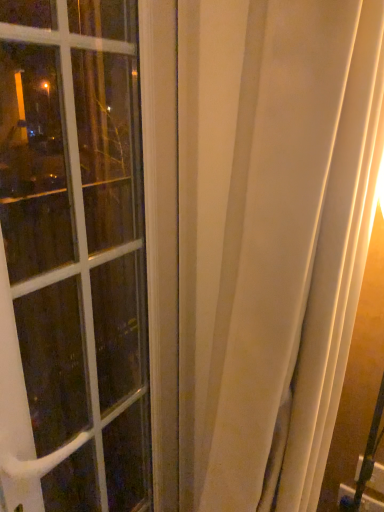
Locate an element on the screen. The height and width of the screenshot is (512, 384). white glass window at left is located at coordinates (76, 261).

The height and width of the screenshot is (512, 384). Describe the element at coordinates (76, 261) in the screenshot. I see `white glass window at left` at that location.

What is the approximate width of white glass window at left?

1.50 inches.

In order to face white sheer curtain at center, should I rotate leftwards or rightwards?

Turn right approximately 7.435 degrees to face it.

What do you see at coordinates (271, 238) in the screenshot? I see `white sheer curtain at center` at bounding box center [271, 238].

Where is `white sheer curtain at center`? This screenshot has width=384, height=512. white sheer curtain at center is located at coordinates (271, 238).

I want to click on white glass window at left, so click(x=76, y=261).

Considering the relative positions of white glass window at left and white sheer curtain at center in the image provided, is white glass window at left to the left of white sheer curtain at center from the viewer's perspective?

Indeed, white glass window at left is positioned on the left side of white sheer curtain at center.

Is white glass window at left closer to the viewer compared to white sheer curtain at center?

No, white glass window at left is further to the viewer.

Which is closer, (55, 205) or (306, 220)?

Point (55, 205).

From the image's perspective, would you say white glass window at left is shown under white sheer curtain at center?

No, from the image's perspective, white glass window at left is not beneath white sheer curtain at center.

From a real-world perspective, is white glass window at left located higher than white sheer curtain at center?

Yes, from a real-world perspective, white glass window at left is above white sheer curtain at center.

Between white glass window at left and white sheer curtain at center, which one has smaller width?

white glass window at left.

Who is taller, white glass window at left or white sheer curtain at center?

white sheer curtain at center.

Does white glass window at left have a larger size compared to white sheer curtain at center?

No, white glass window at left is not bigger than white sheer curtain at center.

Do you think white glass window at left is within white sheer curtain at center, or outside of it?

white glass window at left is spatially situated outside white sheer curtain at center.

Is white glass window at left not close to white sheer curtain at center?

No, there isn't a large distance between white glass window at left and white sheer curtain at center.

Is white glass window at left looking in the opposite direction of white sheer curtain at center?

Yes, white sheer curtain at center is at the back of white glass window at left.

How distant is white glass window at left from white sheer curtain at center?

They are 34.61 centimeters apart.

Where is `window above the white sheer curtain at center (from a real-world perspective)`? window above the white sheer curtain at center (from a real-world perspective) is located at coordinates (76, 261).

Based on their positions, is white sheer curtain at center located to the left or right of white glass window at left?

From the image, it's evident that white sheer curtain at center is to the right of white glass window at left.

Does white sheer curtain at center come in front of white glass window at left?

Yes, white sheer curtain at center is closer to the viewer.

Which is closer, (185, 106) or (71, 424)?

The point (185, 106) is closer.

Consider the image. From the image's perspective, between white sheer curtain at center and white glass window at left, which one is located above?

From the image's view, white glass window at left is above.

From a real-world perspective, is white sheer curtain at center located beneath white glass window at left?

Yes, from a real-world perspective, white sheer curtain at center is under white glass window at left.

Considering the sizes of objects white sheer curtain at center and white glass window at left in the image provided, who is wider, white sheer curtain at center or white glass window at left?

With larger width is white sheer curtain at center.

Does white sheer curtain at center have a lesser height compared to white glass window at left?

No, white sheer curtain at center is not shorter than white glass window at left.

Considering the sizes of objects white sheer curtain at center and white glass window at left in the image provided, who is bigger, white sheer curtain at center or white glass window at left?

Bigger between the two is white sheer curtain at center.

Would you say white glass window at left is part of white sheer curtain at center's contents?

Actually, white glass window at left is outside white sheer curtain at center.

Is white sheer curtain at center not close to white glass window at left?

white sheer curtain at center is actually quite close to white glass window at left.

Is white sheer curtain at center oriented towards white glass window at left?

No, white sheer curtain at center is not facing towards white glass window at left.

Can you tell me how much white sheer curtain at center and white glass window at left differ in facing direction?

1.46 degrees.

Where is `curtain that is below the white glass window at left (from the image's perspective)`? This screenshot has height=512, width=384. curtain that is below the white glass window at left (from the image's perspective) is located at coordinates 271,238.

Where is `window behind the white sheer curtain at center`? Image resolution: width=384 pixels, height=512 pixels. window behind the white sheer curtain at center is located at coordinates (76, 261).

Find the location of `window above the white sheer curtain at center (from a real-world perspective)`. window above the white sheer curtain at center (from a real-world perspective) is located at coordinates tap(76, 261).